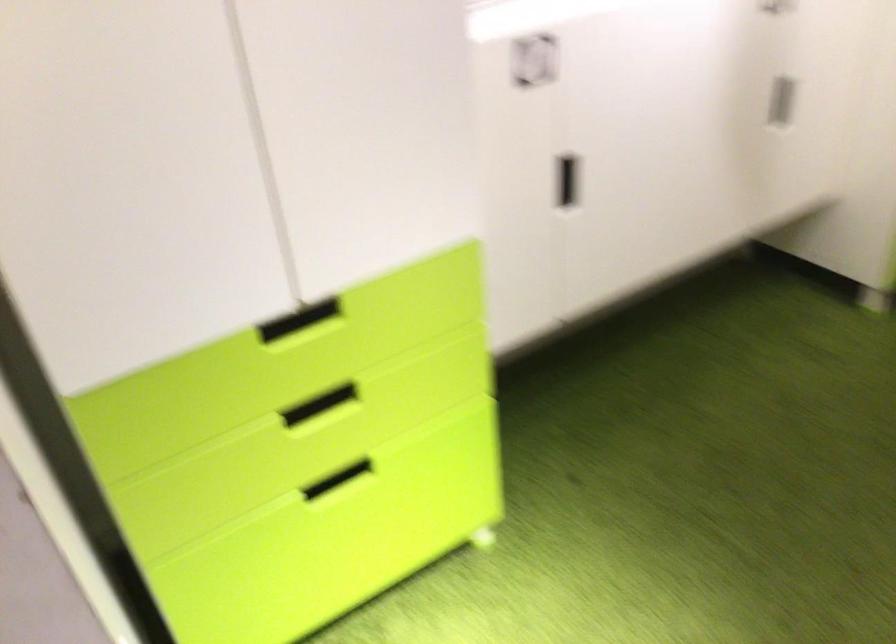
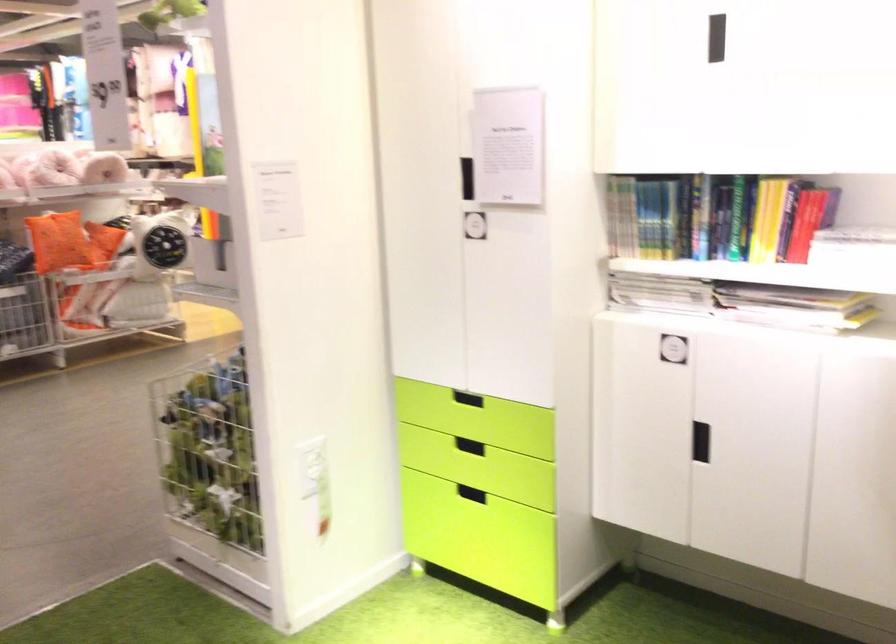
The point at (220, 516) is marked in the first image. Where is the corresponding point in the second image?

(471, 494)